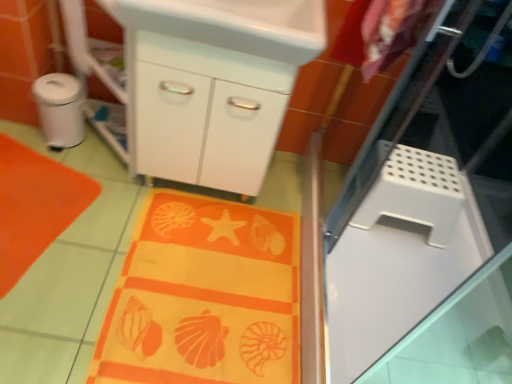
Identify the location of blank space above white plastic step stool at right, which is counted as the first appliance, starting from the right (from a real-world perspective). This screenshot has height=384, width=512. (418, 168).